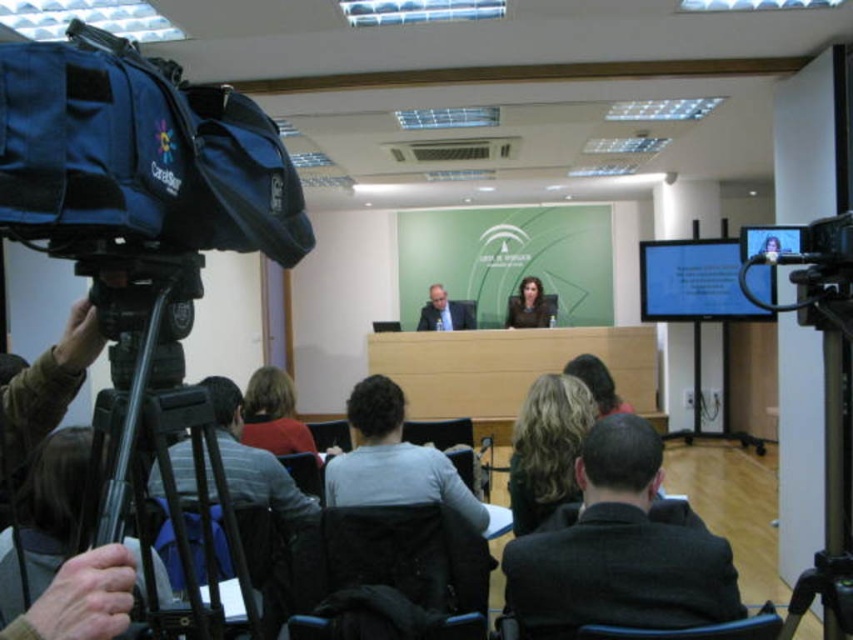
You are a stagehand responsible for setting up a microphone stand that requires 20 feet of space between the dark gray fabric chair at center and the matte brown hair at center. Can you place it between them based on the current setup?

The distance between the dark gray fabric chair at center and the matte brown hair at center is 18.09 feet, which is less than the required 20 feet. Therefore, the microphone stand cannot be placed between them with the necessary space.

You are a photographer at the press conference. You need to position your camera so that it captures both the man in the suit and the woman with shoulder length hair clearly. The camera is mounted on the black plastic tripod at left. Where should you aim the camera to ensure both speakers are in frame?

The camera mounted on the black plastic tripod at left should be aimed towards the stage area where both the man in the suit and the woman with shoulder length hair are seated to ensure they are both in frame.